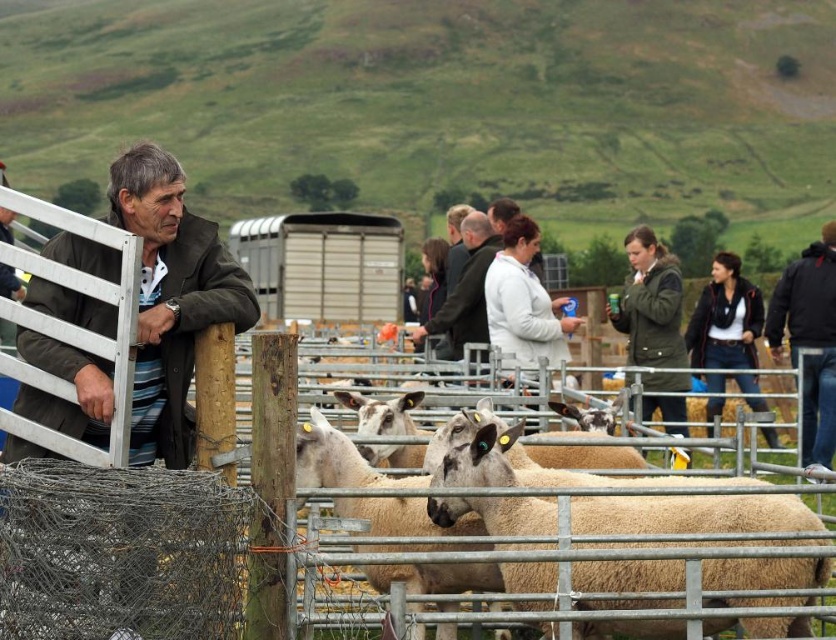
From the picture: You are a photographer at the livestock event. You need to capture a photo that includes both the dark green jacket at right and the white coat at center. Which one should you adjust your camera angle to focus on first to ensure both are in frame?

The dark green jacket at right is located below the white coat at center, so you should focus on the white coat at center first to ensure both are in frame.

You are a photographer at the livestock event. You want to take a photo of the fuzzy woolen sheep at center and the metallic silver fence at center. Which object is located to the left of the other?

The fuzzy woolen sheep at center is positioned on the left side of metallic silver fence at center.